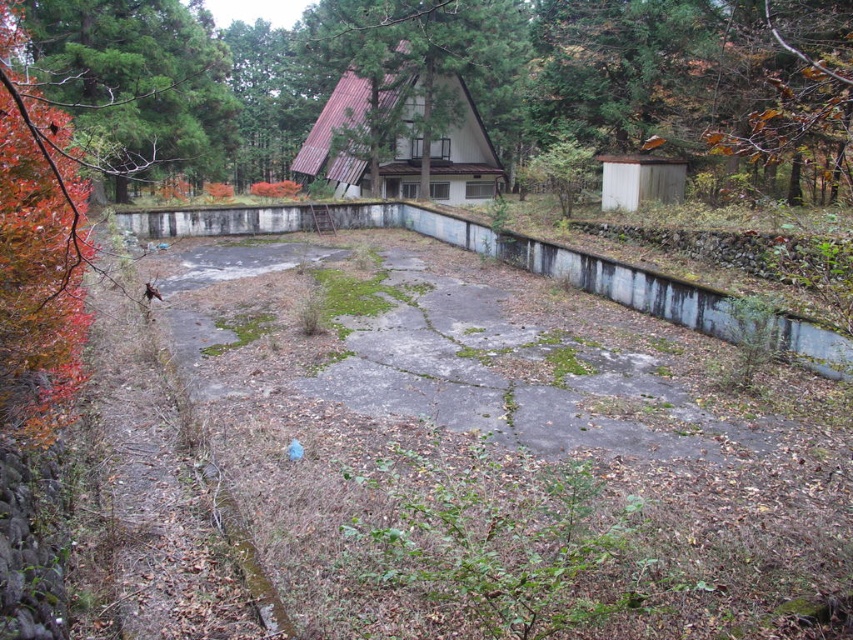
Is point (392, 74) closer to camera compared to point (180, 76)?

Yes, point (392, 74) is in front of point (180, 76).

Which of these two, metallic brown roof at upper center or reddish-brown bark tree at left, stands shorter?

With less height is reddish-brown bark tree at left.

This screenshot has width=853, height=640. What do you see at coordinates (416, 93) in the screenshot?
I see `metallic brown roof at upper center` at bounding box center [416, 93].

This screenshot has height=640, width=853. In order to click on metallic brown roof at upper center in this screenshot , I will do point(416,93).